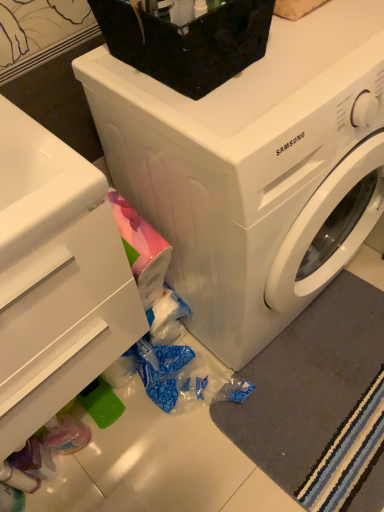
Question: In terms of size, does black plastic container at upper center appear bigger or smaller than white glossy drawer at lower left?

Choices:
 (A) small
 (B) big

Answer: (A)

Question: Is black plastic container at upper center in front of or behind white glossy drawer at lower left in the image?

Choices:
 (A) front
 (B) behind

Answer: (B)

Question: Which of these objects is positioned closest to the gray soft rug at lower right?

Choices:
 (A) white glossy drawer at lower left
 (B) white glossy washing machine at center
 (C) black plastic container at upper center

Answer: (B)

Question: Which is farther from the black plastic container at upper center?

Choices:
 (A) white glossy washing machine at center
 (B) gray soft rug at lower right
 (C) white glossy drawer at lower left

Answer: (B)